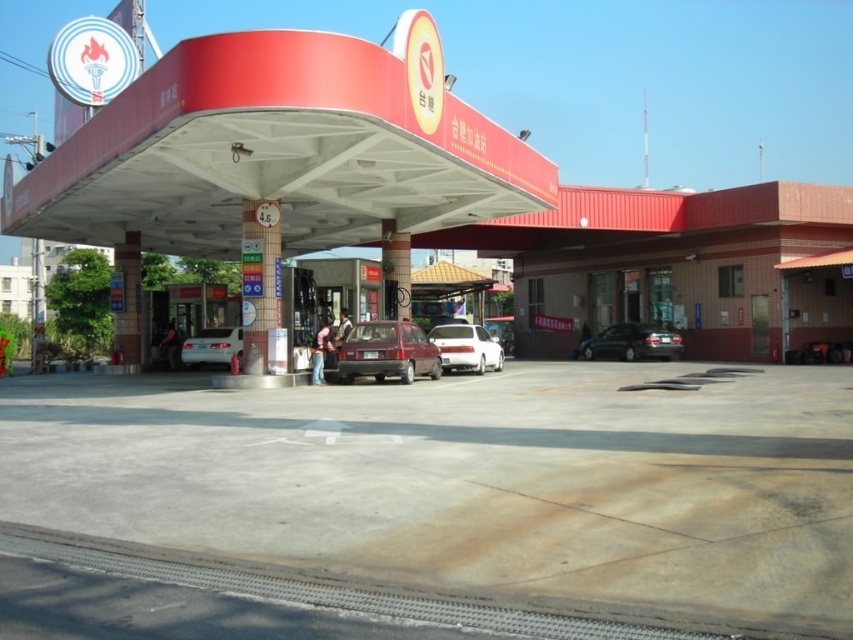
Can you confirm if metallic sign at center is thinner than matte red car at center?

No, metallic sign at center is not thinner than matte red car at center.

Is metallic sign at center wider than matte red car at center?

Yes.

Find the location of a particular element. This screenshot has width=853, height=640. metallic sign at center is located at coordinates (259, 280).

Which is more to the left, matte red gas station at center or matte red car at center?

Positioned to the left is matte red gas station at center.

Is point (202, 209) positioned in front of point (399, 349)?

No, (202, 209) is further to viewer.

Who is more distant from viewer, (x=409, y=128) or (x=372, y=364)?

Point (x=372, y=364)

Where is `matte red gas station at center`? This screenshot has width=853, height=640. matte red gas station at center is located at coordinates (277, 150).

Who is positioned more to the right, metallic sign at center or shiny black sedan at center?

shiny black sedan at center is more to the right.

Is metallic sign at center below shiny black sedan at center?

Incorrect, metallic sign at center is not positioned below shiny black sedan at center.

Is point (254, 317) in front of point (677, 352)?

Yes, point (254, 317) is closer to viewer.

At what (x,y) coordinates should I click in order to perform the action: click on metallic sign at center. Please return your answer as a coordinate pair (x, y). The width and height of the screenshot is (853, 640). Looking at the image, I should click on (259, 280).